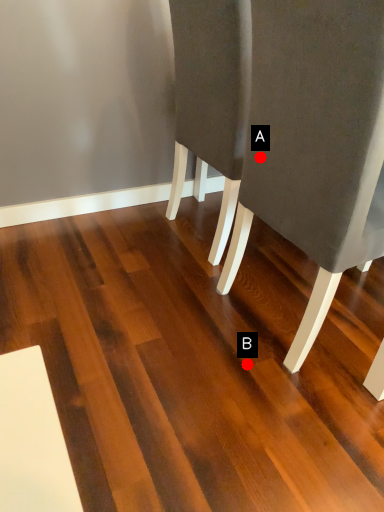
Question: Two points are circled on the image, labeled by A and B beside each circle. Which point appears farthest from the camera in this image?

Choices:
 (A) A is further
 (B) B is further

Answer: (B)